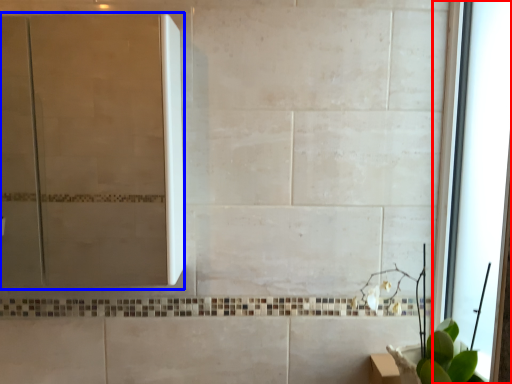
Question: Which of the following is the farthest to the observer, window (highlighted by a red box) or screen door (highlighted by a blue box)?

Choices:
 (A) window
 (B) screen door

Answer: (B)